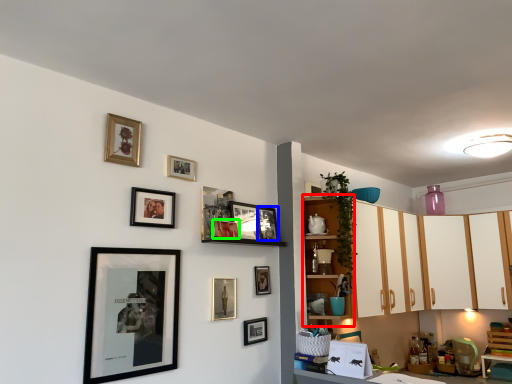
Question: Estimate the real-world distances between objects in this image. Which object is farther from cabinet (highlighted by a red box), picture frame (highlighted by a blue box) or picture frame (highlighted by a green box)?

Choices:
 (A) picture frame
 (B) picture frame

Answer: (B)